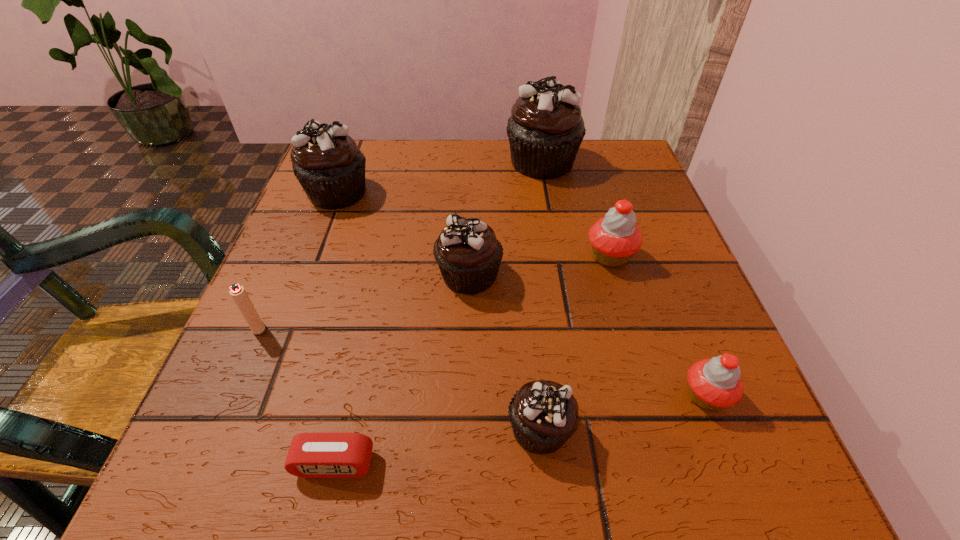
This screenshot has height=540, width=960. Identify the location of vacant region that satisfies the following two spatial constraints: 1. on the back side of the third biggest brown cupcake; 2. on the right side of the bigger red cupcake. (469, 256).

The width and height of the screenshot is (960, 540). Find the location of `vacant area in the image that satisfies the following two spatial constraints: 1. on the back side of the leftmost brown cupcake; 2. on the right side of the fifth farthest object`. vacant area in the image that satisfies the following two spatial constraints: 1. on the back side of the leftmost brown cupcake; 2. on the right side of the fifth farthest object is located at coordinates (317, 193).